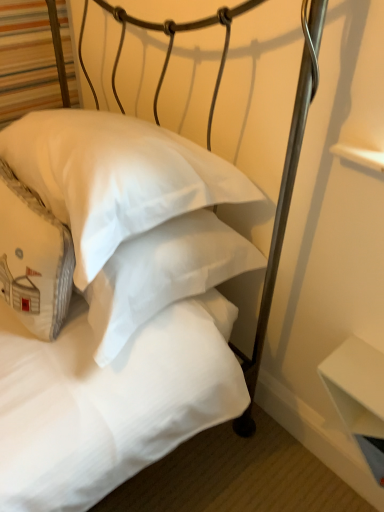
This screenshot has height=512, width=384. What do you see at coordinates (115, 177) in the screenshot?
I see `white matte pillow at center, placed as the 2th pillow when sorted from left to right` at bounding box center [115, 177].

The height and width of the screenshot is (512, 384). What do you see at coordinates (356, 386) in the screenshot?
I see `white matte table at lower right` at bounding box center [356, 386].

What is the approximate width of white cotton pillow at center, which is the second pillow from right to left?

7.14 inches.

Find the location of a particular element. The width and height of the screenshot is (384, 512). white matte pillow at center, the 1th pillow from the right is located at coordinates (115, 177).

Would you say white matte table at lower right is to the left or to the right of white matte pillow at center, the 1th pillow from the right, in the picture?

Clearly, white matte table at lower right is on the right of white matte pillow at center, the 1th pillow from the right, in the image.

Is white matte table at lower right next to white matte pillow at center, the 1th pillow from the right, and touching it?

white matte table at lower right is not next to white matte pillow at center, the 1th pillow from the right, and they're not touching.

Could you tell me if white matte table at lower right is turned towards white matte pillow at center, the 1th pillow from the right?

No, white matte table at lower right is not facing towards white matte pillow at center, the 1th pillow from the right.

From their relative heights in the image, would you say white matte table at lower right is taller or shorter than white matte pillow at center, the 1th pillow from the right?

Considering their sizes, white matte table at lower right has less height than white matte pillow at center, the 1th pillow from the right.

Considering the sizes of white matte table at lower right and white cotton pillow at center, which is the second pillow from right to left, in the image, is white matte table at lower right bigger or smaller than white cotton pillow at center, which is the second pillow from right to left,?

Clearly, white matte table at lower right is smaller in size than white cotton pillow at center, which is the second pillow from right to left.

Is white matte table at lower right positioned far away from white cotton pillow at center, which is the second pillow from right to left?

white matte table at lower right is near white cotton pillow at center, which is the second pillow from right to left, not far away.

Can you confirm if white matte table at lower right is thinner than white cotton pillow at center, which is the second pillow from right to left?

Yes.

Between white matte table at lower right and white cotton pillow at center, marked as the 1th pillow in a left-to-right arrangement, which one appears on the left side from the viewer's perspective?

From the viewer's perspective, white cotton pillow at center, marked as the 1th pillow in a left-to-right arrangement, appears more on the left side.

Which object is positioned more to the left, white matte pillow at center, placed as the 2th pillow when sorted from left to right, or white cotton pillow at center, which is the second pillow from right to left?

white cotton pillow at center, which is the second pillow from right to left.

Based on the photo, which of these two, white matte pillow at center, placed as the 2th pillow when sorted from left to right, or white cotton pillow at center, marked as the 1th pillow in a left-to-right arrangement, is bigger?

white matte pillow at center, placed as the 2th pillow when sorted from left to right.

Is white matte pillow at center, placed as the 2th pillow when sorted from left to right, placed right next to white cotton pillow at center, marked as the 1th pillow in a left-to-right arrangement?

white matte pillow at center, placed as the 2th pillow when sorted from left to right, and white cotton pillow at center, marked as the 1th pillow in a left-to-right arrangement, are not in contact.

In the scene shown: From a real-world perspective, does white cotton pillow at center, which is the second pillow from right to left, sit lower than white matte pillow at center, the 1th pillow from the right?

Yes.

What's the angular difference between white cotton pillow at center, marked as the 1th pillow in a left-to-right arrangement, and white matte pillow at center, the 1th pillow from the right,'s facing directions?

They differ by 2.96 degrees in their facing directions.

Could you tell me if white cotton pillow at center, which is the second pillow from right to left, is turned towards white matte pillow at center, placed as the 2th pillow when sorted from left to right?

Yes, white cotton pillow at center, which is the second pillow from right to left, is oriented towards white matte pillow at center, placed as the 2th pillow when sorted from left to right.

From the image's perspective, is white cotton pillow at center, which is the second pillow from right to left, above or below white matte pillow at center, placed as the 2th pillow when sorted from left to right?

From the image's perspective, white cotton pillow at center, which is the second pillow from right to left, appears below white matte pillow at center, placed as the 2th pillow when sorted from left to right.

Locate an element on the screen. The height and width of the screenshot is (512, 384). pillow that is the 1st one when counting leftward from the white matte table at lower right is located at coordinates (115, 177).

Is white matte pillow at center, placed as the 2th pillow when sorted from left to right, directly adjacent to white matte table at lower right?

white matte pillow at center, placed as the 2th pillow when sorted from left to right, and white matte table at lower right are not in contact.

Which of these two, white matte pillow at center, the 1th pillow from the right, or white matte table at lower right, stands taller?

With more height is white matte pillow at center, the 1th pillow from the right.

Consider the image. Considering the positions of objects white matte pillow at center, placed as the 2th pillow when sorted from left to right, and white matte table at lower right in the image provided, who is more to the left, white matte pillow at center, placed as the 2th pillow when sorted from left to right, or white matte table at lower right?

Positioned to the left is white matte pillow at center, placed as the 2th pillow when sorted from left to right.

Which point is more forward, (32, 275) or (358, 419)?

The point (32, 275) is closer to the camera.

Where is `table behind the white cotton pillow at center, marked as the 1th pillow in a left-to-right arrangement`? This screenshot has width=384, height=512. table behind the white cotton pillow at center, marked as the 1th pillow in a left-to-right arrangement is located at coordinates (356, 386).

Considering the sizes of objects white cotton pillow at center, marked as the 1th pillow in a left-to-right arrangement, and white matte table at lower right in the image provided, who is bigger, white cotton pillow at center, marked as the 1th pillow in a left-to-right arrangement, or white matte table at lower right?

white cotton pillow at center, marked as the 1th pillow in a left-to-right arrangement, is bigger.

From the picture: From a real-world perspective, relative to white matte table at lower right, is white cotton pillow at center, marked as the 1th pillow in a left-to-right arrangement, vertically above or below?

In terms of real-world spatial position, white cotton pillow at center, marked as the 1th pillow in a left-to-right arrangement, is above white matte table at lower right.

Where is `the 2nd pillow located above the white matte table at lower right (from a real-world perspective)`? This screenshot has width=384, height=512. the 2nd pillow located above the white matte table at lower right (from a real-world perspective) is located at coordinates (115, 177).

Identify the location of the 1st pillow in front of the white matte table at lower right, counting from the anchor's position. (33, 258).

Looking at this image, looking at the image, which one is located closer to white cotton pillow at center, marked as the 1th pillow in a left-to-right arrangement, white matte pillow at center, placed as the 2th pillow when sorted from left to right, or white matte table at lower right?

white matte pillow at center, placed as the 2th pillow when sorted from left to right, lies closer to white cotton pillow at center, marked as the 1th pillow in a left-to-right arrangement, than the other object.

Looking at the image, which one is located further to white matte table at lower right, white matte pillow at center, placed as the 2th pillow when sorted from left to right, or white cotton pillow at center, marked as the 1th pillow in a left-to-right arrangement?

Among the two, white cotton pillow at center, marked as the 1th pillow in a left-to-right arrangement, is located further to white matte table at lower right.

Estimate the real-world distances between objects in this image. Which object is closer to white matte table at lower right, white cotton pillow at center, which is the second pillow from right to left, or white matte pillow at center, placed as the 2th pillow when sorted from left to right?

Among the two, white matte pillow at center, placed as the 2th pillow when sorted from left to right, is located nearer to white matte table at lower right.

From the image, which object appears to be farther from white matte pillow at center, the 1th pillow from the right, white cotton pillow at center, marked as the 1th pillow in a left-to-right arrangement, or white matte table at lower right?

Among the two, white matte table at lower right is located further to white matte pillow at center, the 1th pillow from the right.

When comparing their distances from white matte pillow at center, the 1th pillow from the right, does white matte table at lower right or white cotton pillow at center, marked as the 1th pillow in a left-to-right arrangement, seem closer?

white cotton pillow at center, marked as the 1th pillow in a left-to-right arrangement, is closer to white matte pillow at center, the 1th pillow from the right.

Looking at the image, which one is located closer to white cotton pillow at center, marked as the 1th pillow in a left-to-right arrangement, white matte table at lower right or white matte pillow at center, the 1th pillow from the right?

Among the two, white matte pillow at center, the 1th pillow from the right, is located nearer to white cotton pillow at center, marked as the 1th pillow in a left-to-right arrangement.

You are a GUI agent. You are given a task and a screenshot of the screen. Output one action in this format:
    pyautogui.click(x=<x>, y=<y>)
    Task: Click on the pillow located between white cotton pillow at center, which is the second pillow from right to left, and white matte table at lower right in the left-right direction
    
    Given the screenshot: What is the action you would take?
    pyautogui.click(x=115, y=177)